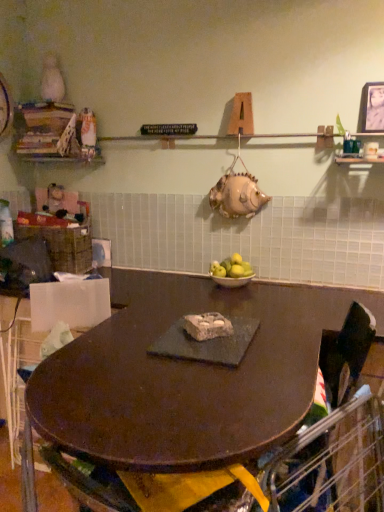
Question: Is black fabric swivel chair at center to the right of yellow matte apples at center from the viewer's perspective?

Choices:
 (A) no
 (B) yes

Answer: (B)

Question: From a real-world perspective, is black fabric swivel chair at center positioned under yellow matte apples at center based on gravity?

Choices:
 (A) yes
 (B) no

Answer: (A)

Question: Does black fabric swivel chair at center have a larger size compared to yellow matte apples at center?

Choices:
 (A) no
 (B) yes

Answer: (B)

Question: From the image's perspective, is black fabric swivel chair at center over yellow matte apples at center?

Choices:
 (A) no
 (B) yes

Answer: (A)

Question: Is black fabric swivel chair at center with yellow matte apples at center?

Choices:
 (A) no
 (B) yes

Answer: (A)

Question: Would you say metallic silver photo frame at upper right is to the left or to the right of black fabric swivel chair at center in the picture?

Choices:
 (A) left
 (B) right

Answer: (B)

Question: Considering the positions of metallic silver photo frame at upper right and black fabric swivel chair at center in the image, is metallic silver photo frame at upper right taller or shorter than black fabric swivel chair at center?

Choices:
 (A) tall
 (B) short

Answer: (B)

Question: Considering the positions of metallic silver photo frame at upper right and black fabric swivel chair at center in the image, is metallic silver photo frame at upper right bigger or smaller than black fabric swivel chair at center?

Choices:
 (A) small
 (B) big

Answer: (A)

Question: Considering the positions of metallic silver photo frame at upper right and black fabric swivel chair at center in the image, is metallic silver photo frame at upper right wider or thinner than black fabric swivel chair at center?

Choices:
 (A) thin
 (B) wide

Answer: (A)

Question: From their relative heights in the image, would you say wooden books at upper left is taller or shorter than yellow matte apples at center?

Choices:
 (A) short
 (B) tall

Answer: (B)

Question: Looking at their shapes, would you say wooden books at upper left is wider or thinner than yellow matte apples at center?

Choices:
 (A) wide
 (B) thin

Answer: (A)

Question: Is point (44, 158) positioned closer to the camera than point (236, 272)?

Choices:
 (A) farther
 (B) closer

Answer: (A)

Question: From a real-world perspective, is wooden books at upper left above or below yellow matte apples at center?

Choices:
 (A) above
 (B) below

Answer: (A)

Question: From a real-world perspective, is dark brown wood table at center above or below metallic silver photo frame at upper right?

Choices:
 (A) above
 (B) below

Answer: (B)

Question: Would you say dark brown wood table at center is to the left or to the right of metallic silver photo frame at upper right in the picture?

Choices:
 (A) right
 (B) left

Answer: (B)